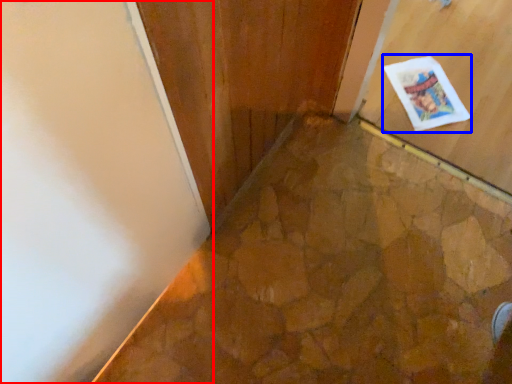
Question: Which object appears farthest to the camera in this image, door (highlighted by a red box) or postcard (highlighted by a blue box)?

Choices:
 (A) door
 (B) postcard

Answer: (B)